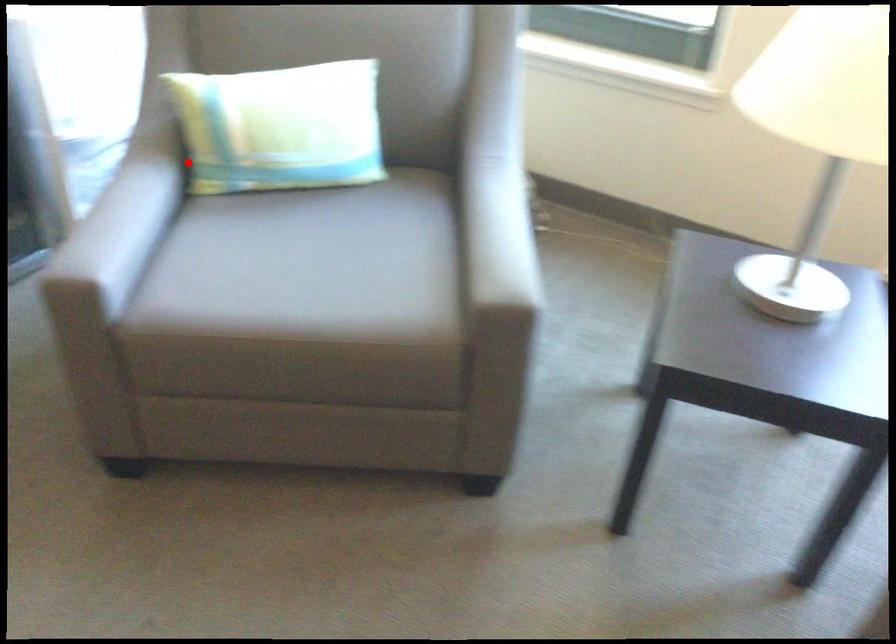
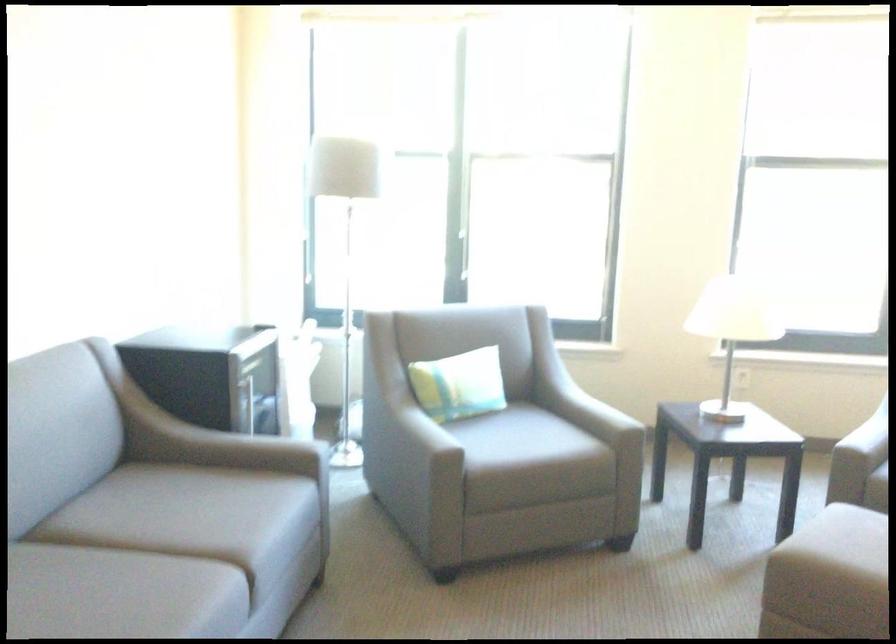
In the second image, find the point that corresponds to the highlighted location in the first image.

(356, 420)